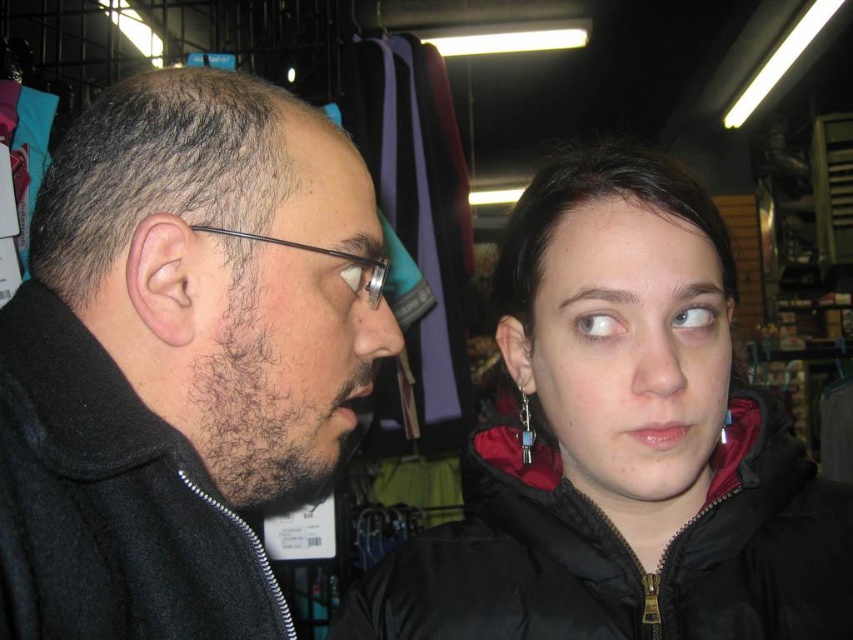
Which of these two, dark brown hair at left or matte black jacket at center, stands shorter?

With less height is matte black jacket at center.

Which is more to the left, dark brown hair at left or matte black jacket at center?

From the viewer's perspective, dark brown hair at left appears more on the left side.

Between point (317, 202) and point (616, 461), which one is positioned in front?

Point (317, 202) is in front.

This screenshot has width=853, height=640. What are the coordinates of `dark brown hair at left` in the screenshot? It's located at (292, 324).

Is black matte jacket at left thinner than blue crystal pendant at upper center?

Incorrect, black matte jacket at left's width is not less than blue crystal pendant at upper center's.

You are a GUI agent. You are given a task and a screenshot of the screen. Output one action in this format:
    pyautogui.click(x=<x>, y=<y>)
    Task: Click on the black matte jacket at left
    
    Given the screenshot: What is the action you would take?
    pyautogui.click(x=181, y=356)

This screenshot has height=640, width=853. Identify the location of black matte jacket at left. (181, 356).

Can you confirm if matte black jacket at center is wider than dark brown hair at upper center?

Correct, the width of matte black jacket at center exceeds that of dark brown hair at upper center.

Locate an element on the screen. Image resolution: width=853 pixels, height=640 pixels. matte black jacket at center is located at coordinates (628, 352).

Locate an element on the screen. matte black jacket at center is located at coordinates (628, 352).